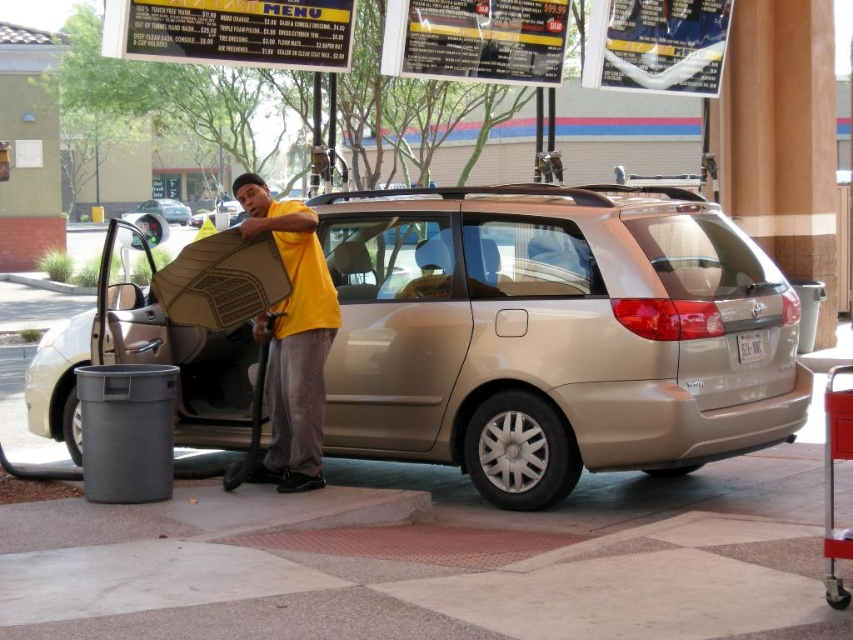
Is point (561, 339) more distant than point (186, 218)?

No, it is in front of (186, 218).

Is gold metallic suv at center smaller than gold metallic van at center?

Correct, gold metallic suv at center occupies less space than gold metallic van at center.

Is point (544, 259) behind point (171, 211)?

No, it is not.

Locate an element on the screen. Image resolution: width=853 pixels, height=640 pixels. gold metallic suv at center is located at coordinates click(x=554, y=333).

Does yellow matte shirt at center have a larger size compared to gold metallic van at center?

Incorrect, yellow matte shirt at center is not larger than gold metallic van at center.

How distant is yellow matte shirt at center from gold metallic van at center?

yellow matte shirt at center and gold metallic van at center are 46.11 meters apart.

Is point (318, 262) positioned behind point (178, 220)?

No, (318, 262) is closer to viewer.

Locate an element on the screen. The height and width of the screenshot is (640, 853). yellow matte shirt at center is located at coordinates (292, 337).

Is gold metallic suv at center smaller than yellow matte shirt at center?

Actually, gold metallic suv at center might be larger than yellow matte shirt at center.

Between point (59, 355) and point (282, 410), which one is positioned behind?

Positioned behind is point (59, 355).

The image size is (853, 640). I want to click on gold metallic suv at center, so click(x=554, y=333).